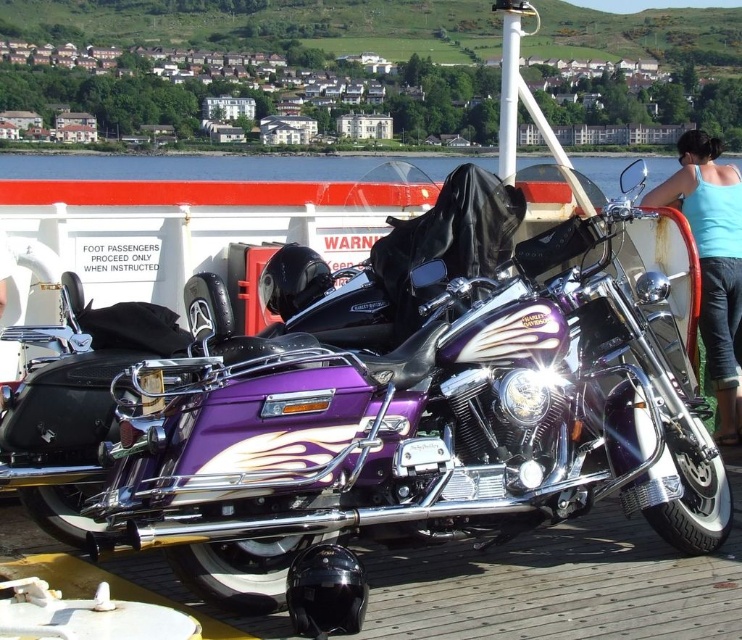
Can you confirm if purple glossy motorcycle at center is wider than blue fabric tank top at upper right?

Yes.

Which is behind, point (289, 451) or point (720, 385)?

The point (720, 385) is behind.

At what (x,y) coordinates should I click in order to perform the action: click on purple glossy motorcycle at center. Please return your answer as a coordinate pair (x, y). This screenshot has height=640, width=742. Looking at the image, I should click on (387, 426).